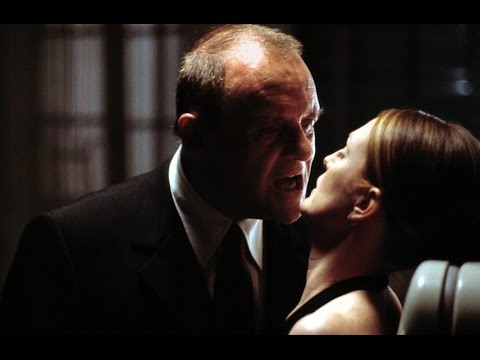
The width and height of the screenshot is (480, 360). Identify the location of window. [92, 150], [146, 150].